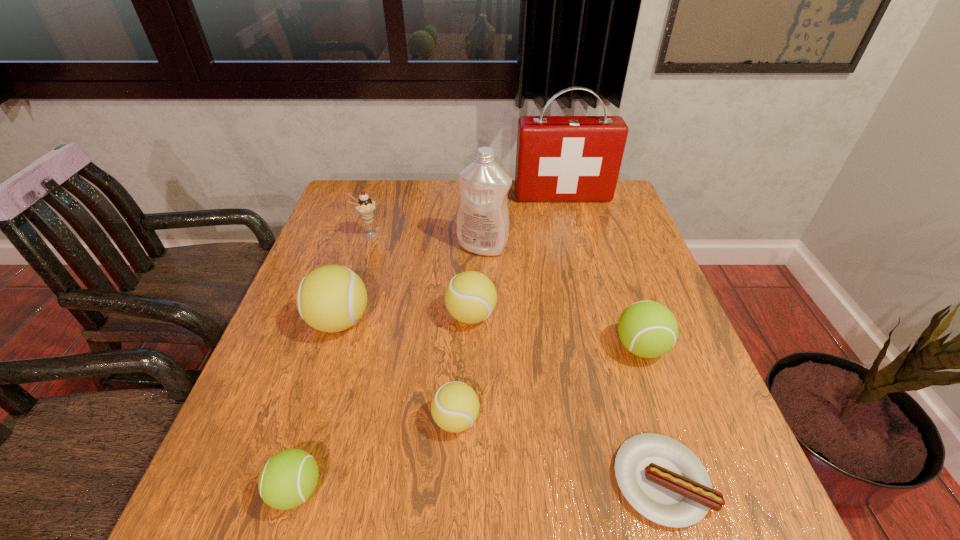
Find the location of a particular element. object that stands as the seventh closest to the icecream is located at coordinates (648, 329).

At what (x,y) coordinates should I click in order to perform the action: click on tennis ball that is the fifth closest to the shortest object. Please return your answer as a coordinate pair (x, y). Image resolution: width=960 pixels, height=540 pixels. Looking at the image, I should click on (332, 298).

Point out which tennis ball is positioned as the nearest to the first-aid kit. Please provide its 2D coordinates. Your answer should be formatted as a tuple, i.e. [(x, y)], where the tuple contains the x and y coordinates of a point satisfying the conditions above.

[(470, 297)]

This screenshot has height=540, width=960. What are the coordinates of `yellow tennis ball that is the nearest to the smaller green tennis ball` in the screenshot? It's located at (455, 406).

I want to click on yellow tennis ball that is the closest to the icecream, so click(332, 298).

The image size is (960, 540). I want to click on vacant space that satisfies the following two spatial constraints: 1. on the front side of the icecream; 2. on the right side of the smaller green tennis ball, so click(290, 490).